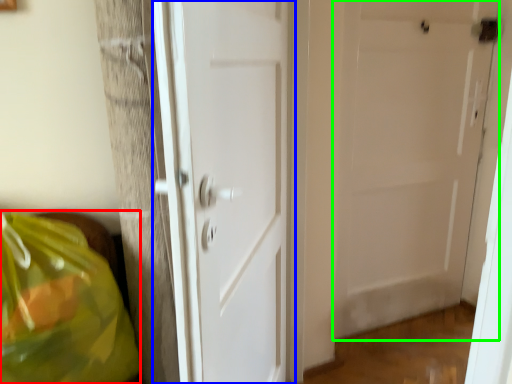
Question: Based on their relative distances, which object is nearer to grocery bag (highlighted by a red box)? Choose from door (highlighted by a blue box) and door (highlighted by a green box).

Choices:
 (A) door
 (B) door

Answer: (A)